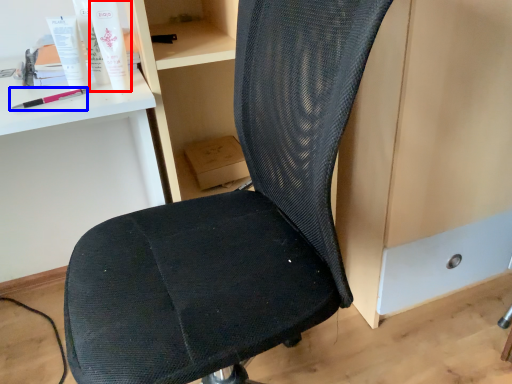
Question: Which object appears closest to the camera in this image, toiletry (highlighted by a red box) or equipment (highlighted by a blue box)?

Choices:
 (A) toiletry
 (B) equipment

Answer: (A)